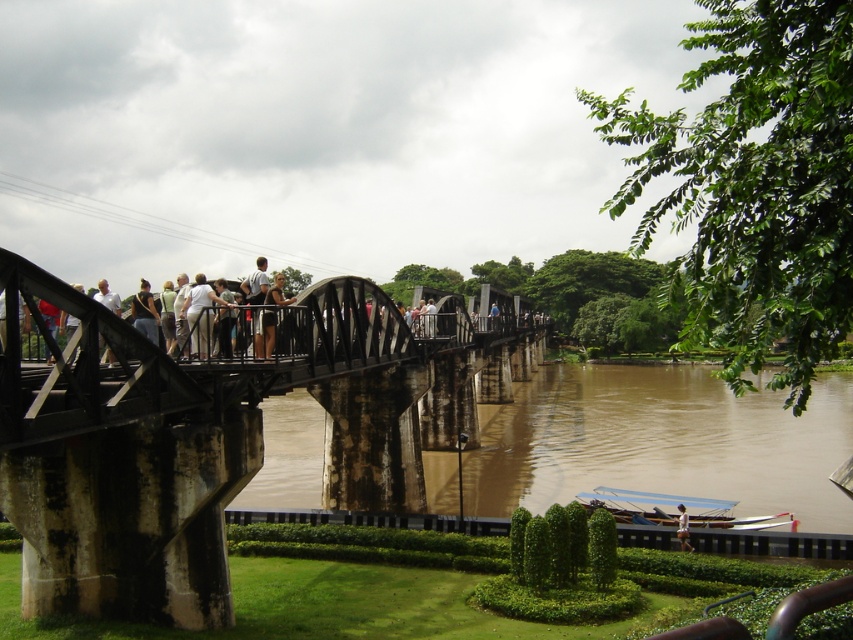
Is brown muddy water at lower center closer to the viewer compared to blue plastic boat at lower right?

No, brown muddy water at lower center is further to the viewer.

Can you confirm if brown muddy water at lower center is positioned to the left of blue plastic boat at lower right?

In fact, brown muddy water at lower center is to the right of blue plastic boat at lower right.

In order to click on brown muddy water at lower center in this screenshot , I will do `click(662, 442)`.

The width and height of the screenshot is (853, 640). Find the location of `brown muddy water at lower center`. brown muddy water at lower center is located at coordinates (662, 442).

Can you confirm if blue plastic boat at lower right is positioned to the right of light brown wooden bridge at center?

Indeed, blue plastic boat at lower right is positioned on the right side of light brown wooden bridge at center.

Where is `blue plastic boat at lower right`? The height and width of the screenshot is (640, 853). blue plastic boat at lower right is located at coordinates [677, 509].

Identify the location of blue plastic boat at lower right. Image resolution: width=853 pixels, height=640 pixels. (677, 509).

How distant is blue plastic boat at lower right from white fabric shirt at upper center?

blue plastic boat at lower right is 4.43 meters from white fabric shirt at upper center.

Is point (630, 497) closer to camera compared to point (683, 547)?

No, (630, 497) is behind (683, 547).

I want to click on blue plastic boat at lower right, so click(x=677, y=509).

The width and height of the screenshot is (853, 640). In order to click on blue plastic boat at lower right in this screenshot , I will do `click(677, 509)`.